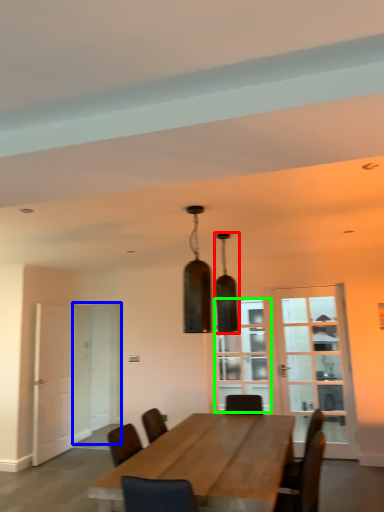
Question: Based on their relative distances, which object is farther from lamp (highlighted by a red box)? Choose from glass door (highlighted by a blue box) and window (highlighted by a green box).

Choices:
 (A) glass door
 (B) window

Answer: (A)